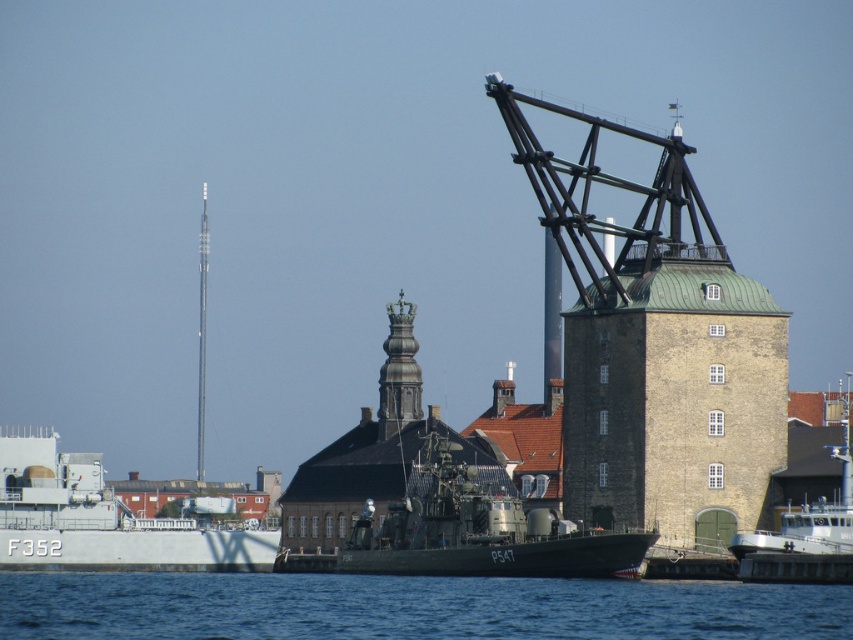
Which is more to the left, blue water at lower center or white matte boat at center?

blue water at lower center

Can you confirm if blue water at lower center is positioned above white matte boat at center?

No.

Who is more distant from viewer, (469, 589) or (798, 547)?

Point (469, 589)

Identify the location of blue water at lower center. (409, 605).

Who is higher up, blue water at lower center or green matte military boat at center?

green matte military boat at center

Looking at this image, is blue water at lower center above green matte military boat at center?

Actually, blue water at lower center is below green matte military boat at center.

This screenshot has height=640, width=853. What are the coordinates of `blue water at lower center` in the screenshot? It's located at (409, 605).

Which of these two, blue water at lower center or white matte ship at left, stands taller?

white matte ship at left is taller.

Is blue water at lower center shorter than white matte ship at left?

Yes, blue water at lower center is shorter than white matte ship at left.

Identify the location of blue water at lower center. The image size is (853, 640). point(409,605).